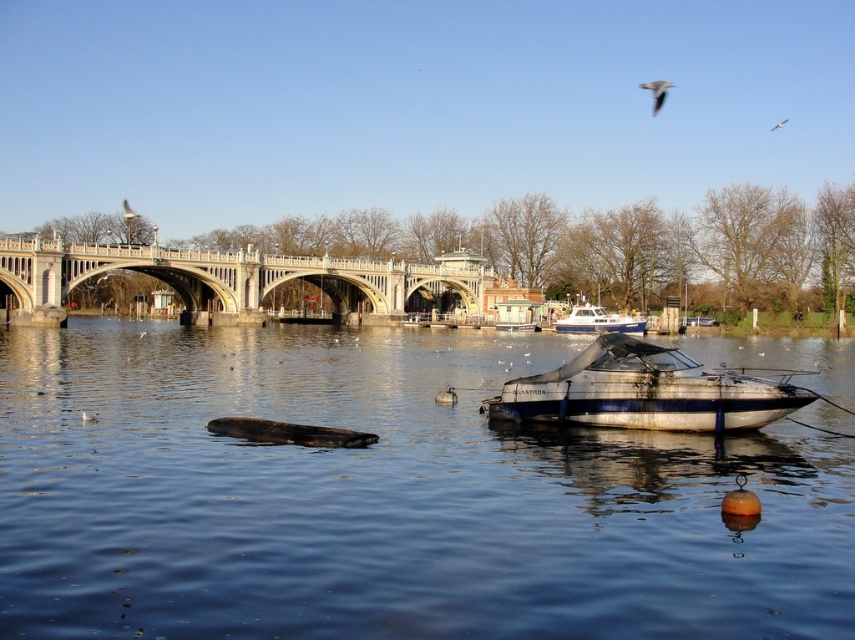
Is blue metallic boat at lower center above white glossy boat at center?

Incorrect, blue metallic boat at lower center is not positioned above white glossy boat at center.

Who is lower down, blue metallic boat at lower center or white glossy boat at center?

Positioned lower is blue metallic boat at lower center.

Find the location of a particular element. blue metallic boat at lower center is located at coordinates (385, 499).

Find the location of a particular element. Image resolution: width=855 pixels, height=640 pixels. blue metallic boat at lower center is located at coordinates (385, 499).

Does blue metallic boat at lower center have a smaller size compared to white feathered bird at upper left?

No, blue metallic boat at lower center is not smaller than white feathered bird at upper left.

Does blue metallic boat at lower center have a larger size compared to white feathered bird at upper left?

Yes.

Describe the element at coordinates (385, 499) in the screenshot. I see `blue metallic boat at lower center` at that location.

Locate an element on the screen. blue metallic boat at lower center is located at coordinates (385, 499).

Does blue metallic boat at lower center have a lesser width compared to gray feathered bird at upper right?

In fact, blue metallic boat at lower center might be wider than gray feathered bird at upper right.

From the picture: Does blue metallic boat at lower center have a greater height compared to gray feathered bird at upper right?

Yes, blue metallic boat at lower center is taller than gray feathered bird at upper right.

Image resolution: width=855 pixels, height=640 pixels. What do you see at coordinates (385, 499) in the screenshot?
I see `blue metallic boat at lower center` at bounding box center [385, 499].

Image resolution: width=855 pixels, height=640 pixels. I want to click on blue metallic boat at lower center, so click(385, 499).